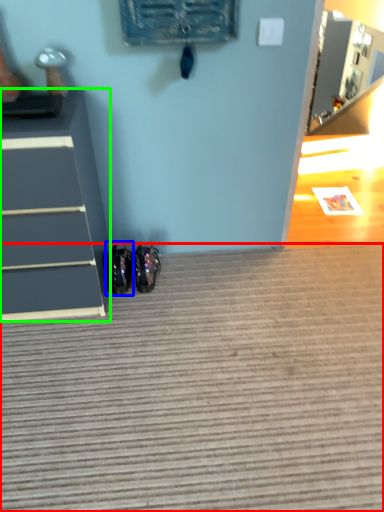
Question: Which object is positioned farthest from doormat (highlighted by a red box)? Select from footwear (highlighted by a blue box) and chest of drawers (highlighted by a green box).

Choices:
 (A) footwear
 (B) chest of drawers

Answer: (A)